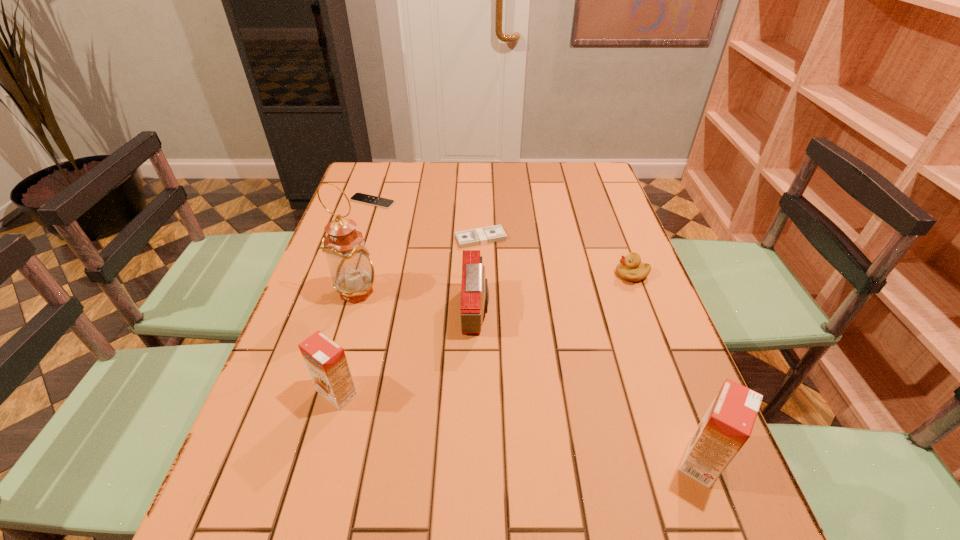
At what (x,y) coordinates should I click in order to perform the action: click on the third tallest object. Please return your answer as a coordinate pair (x, y). Looking at the image, I should click on (326, 361).

You are a GUI agent. You are given a task and a screenshot of the screen. Output one action in this format:
    pyautogui.click(x=<x>, y=<y>)
    Task: Click on the left orange juice
    The height and width of the screenshot is (540, 960).
    Given the screenshot: What is the action you would take?
    pyautogui.click(x=326, y=361)

Locate an element on the screen. The image size is (960, 540). the nearer orange juice is located at coordinates (727, 425).

This screenshot has width=960, height=540. Identify the location of the nearest object. (727, 425).

Image resolution: width=960 pixels, height=540 pixels. I want to click on dollar, so click(485, 235).

The height and width of the screenshot is (540, 960). In order to click on the sixth tallest object in this screenshot , I will do [485, 235].

Where is `duckling`? duckling is located at coordinates (630, 268).

This screenshot has height=540, width=960. Find the location of `remote control`. remote control is located at coordinates (357, 197).

I want to click on the farthest object, so (x=357, y=197).

Locate an element on the screen. This screenshot has width=960, height=540. oil lamp is located at coordinates (352, 271).